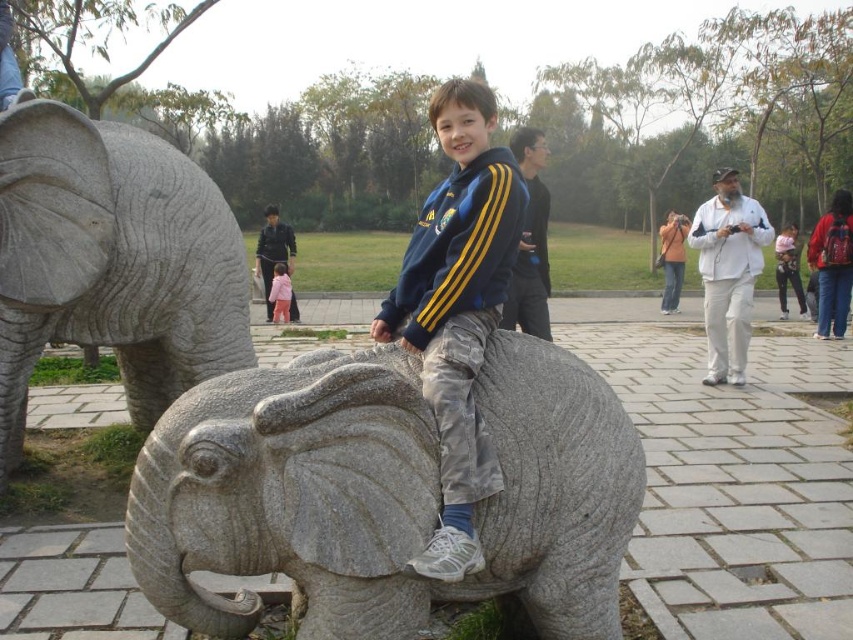
Can you confirm if gray stone elephant at center is wider than gray stone elephant at left?

Correct, the width of gray stone elephant at center exceeds that of gray stone elephant at left.

Is gray stone elephant at center smaller than gray stone elephant at left?

Correct, gray stone elephant at center occupies less space than gray stone elephant at left.

Describe the element at coordinates (386, 493) in the screenshot. I see `gray stone elephant at center` at that location.

This screenshot has width=853, height=640. What are the coordinates of `gray stone elephant at center` in the screenshot? It's located at (386, 493).

Which is more to the right, gray stone elephant at center or matte gray elephant at center?

From the viewer's perspective, matte gray elephant at center appears more on the right side.

Consider the image. Does gray stone elephant at center have a larger size compared to matte gray elephant at center?

Yes.

Find the location of a particular element. This screenshot has height=640, width=853. gray stone elephant at center is located at coordinates (386, 493).

Is point (426, 492) closer to camera compared to point (285, 276)?

Yes, it is in front of point (285, 276).

Can you confirm if gray stone elephant at center is bigger than pink fabric child at center?

Yes, gray stone elephant at center is bigger than pink fabric child at center.

Is point (566, 632) positioned before point (287, 291)?

That is True.

Where is `gray stone elephant at center`? gray stone elephant at center is located at coordinates (386, 493).